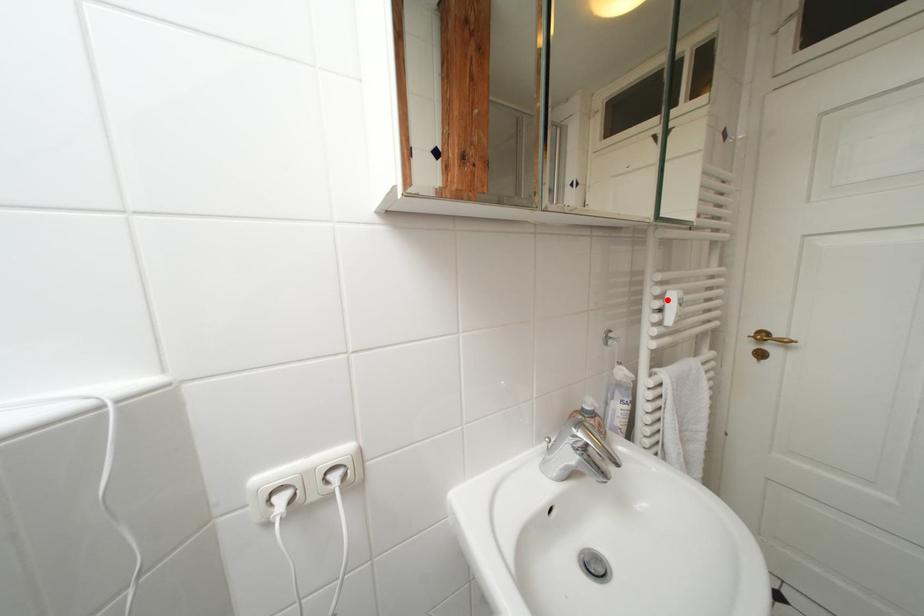
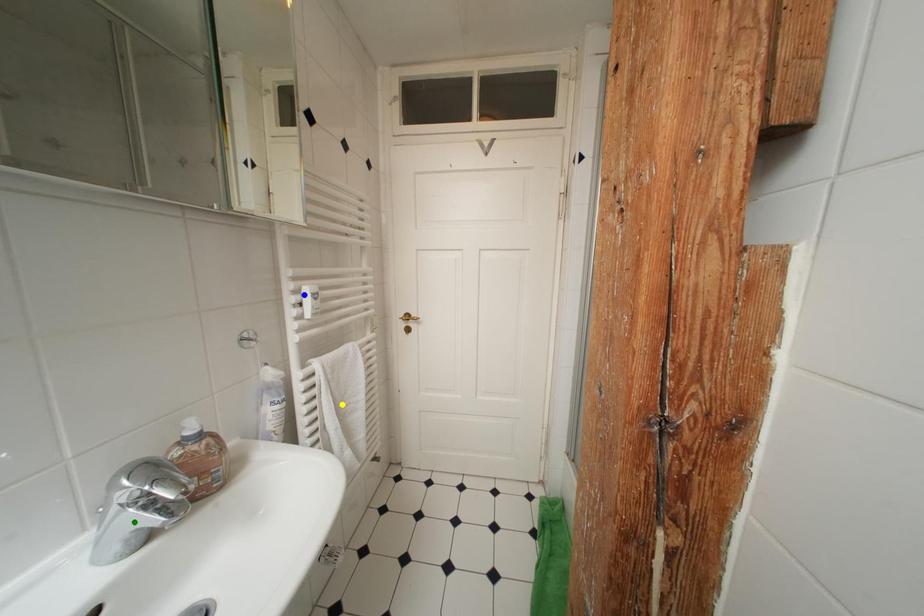
Question: I am providing you with two images of the same scene from different viewpoints. A red point is marked on the first image. You are given multiple points on the second image. Which point in image 2 is actually the same real-world point as the red point in image 1?

Choices:
 (A) yellow point
 (B) green point
 (C) blue point

Answer: (C)